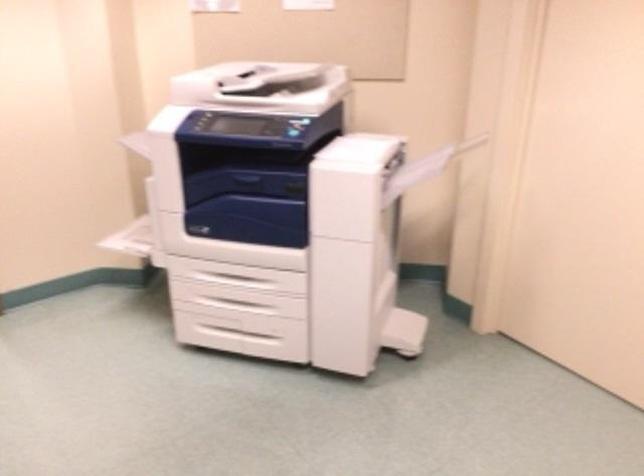
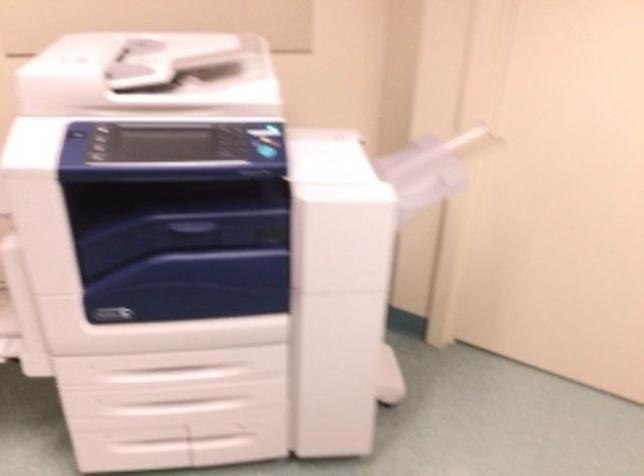
Locate, in the second image, the point that corresponds to (x=242, y=337) in the first image.

(183, 442)